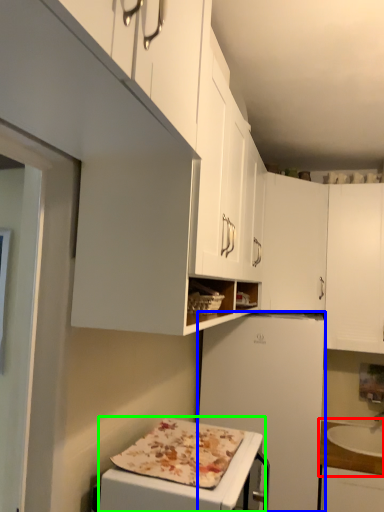
Question: Which object is positioned closest to countertop (highlighted by a red box)? Select from refrigerator (highlighted by a blue box) and appliance (highlighted by a green box).

Choices:
 (A) refrigerator
 (B) appliance

Answer: (A)